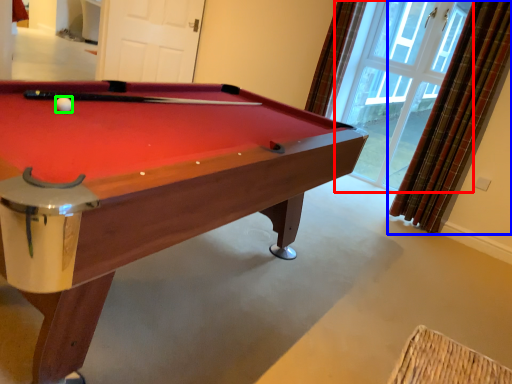
Question: Based on their relative distances, which object is nearer to window (highlighted by a red box)? Choose from curtain (highlighted by a blue box) and ball (highlighted by a green box).

Choices:
 (A) curtain
 (B) ball

Answer: (A)